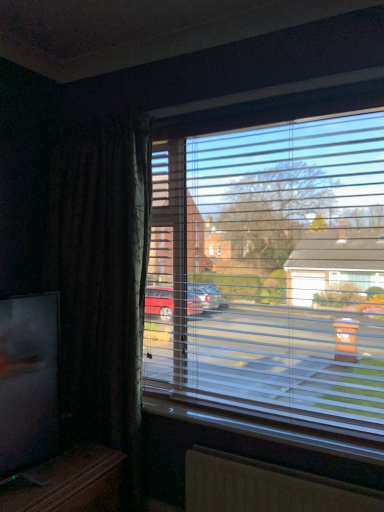
Question: Does transparent plastic blinds at center appear on the left side of white plastic window sill at lower center?

Choices:
 (A) no
 (B) yes

Answer: (A)

Question: Would you consider transparent plastic blinds at center to be distant from white plastic window sill at lower center?

Choices:
 (A) no
 (B) yes

Answer: (A)

Question: Is transparent plastic blinds at center shorter than white plastic window sill at lower center?

Choices:
 (A) yes
 (B) no

Answer: (B)

Question: Is white plastic window sill at lower center a part of transparent plastic blinds at center?

Choices:
 (A) yes
 (B) no

Answer: (B)

Question: From the image's perspective, does transparent plastic blinds at center appear lower than white plastic window sill at lower center?

Choices:
 (A) yes
 (B) no

Answer: (B)

Question: Based on their positions, is brown textured radiator at lower center located to the left or right of matte black tv at lower left?

Choices:
 (A) left
 (B) right

Answer: (B)

Question: Choose the correct answer: Is brown textured radiator at lower center inside matte black tv at lower left or outside it?

Choices:
 (A) inside
 (B) outside

Answer: (B)

Question: From their relative heights in the image, would you say brown textured radiator at lower center is taller or shorter than matte black tv at lower left?

Choices:
 (A) tall
 (B) short

Answer: (B)

Question: In terms of size, does brown textured radiator at lower center appear bigger or smaller than matte black tv at lower left?

Choices:
 (A) big
 (B) small

Answer: (B)

Question: Is transparent plastic blinds at center inside the boundaries of matte black tv at lower left, or outside?

Choices:
 (A) outside
 (B) inside

Answer: (A)

Question: From the image's perspective, relative to matte black tv at lower left, is transparent plastic blinds at center above or below?

Choices:
 (A) above
 (B) below

Answer: (A)

Question: In the image, is transparent plastic blinds at center on the left side or the right side of matte black tv at lower left?

Choices:
 (A) left
 (B) right

Answer: (B)

Question: Is transparent plastic blinds at center wider or thinner than matte black tv at lower left?

Choices:
 (A) thin
 (B) wide

Answer: (A)

Question: Is point (289, 416) positioned closer to the camera than point (192, 458)?

Choices:
 (A) closer
 (B) farther

Answer: (B)

Question: In terms of height, does white plastic window sill at lower center look taller or shorter compared to brown textured radiator at lower center?

Choices:
 (A) tall
 (B) short

Answer: (B)